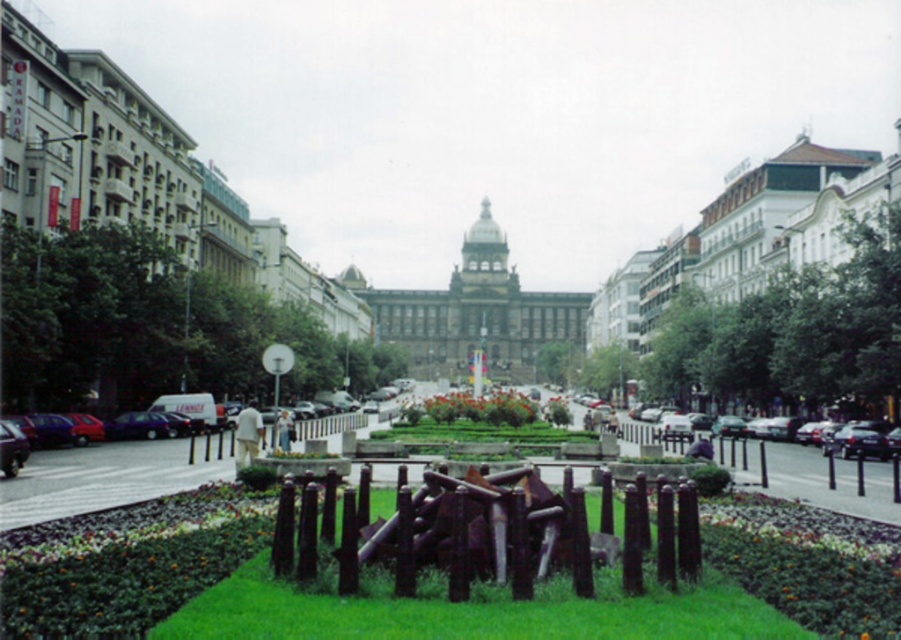
Is green grass at center taller than black metal fence at lower right?

Yes, green grass at center is taller than black metal fence at lower right.

The image size is (901, 640). Describe the element at coordinates (470, 611) in the screenshot. I see `green grass at center` at that location.

Which is behind, point (378, 592) or point (885, 481)?

The point (885, 481) is more distant.

Identify the location of green grass at center. (470, 611).

Is green grass at center thinner than dark brown wooden fence at center?

No, green grass at center is not thinner than dark brown wooden fence at center.

Does green grass at center have a lesser height compared to dark brown wooden fence at center?

Yes, green grass at center is shorter than dark brown wooden fence at center.

Between point (266, 608) and point (448, 566), which one is positioned behind?

The point (448, 566) is more distant.

Locate an element on the screen. The width and height of the screenshot is (901, 640). green grass at center is located at coordinates (470, 611).

Describe the element at coordinates (475, 532) in the screenshot. I see `dark brown wooden fence at center` at that location.

Who is more forward, (411, 516) or (794, 488)?

Point (411, 516) is more forward.

In order to click on dark brown wooden fence at center in this screenshot , I will do `click(475, 532)`.

The width and height of the screenshot is (901, 640). What are the coordinates of `dark brown wooden fence at center` in the screenshot? It's located at (475, 532).